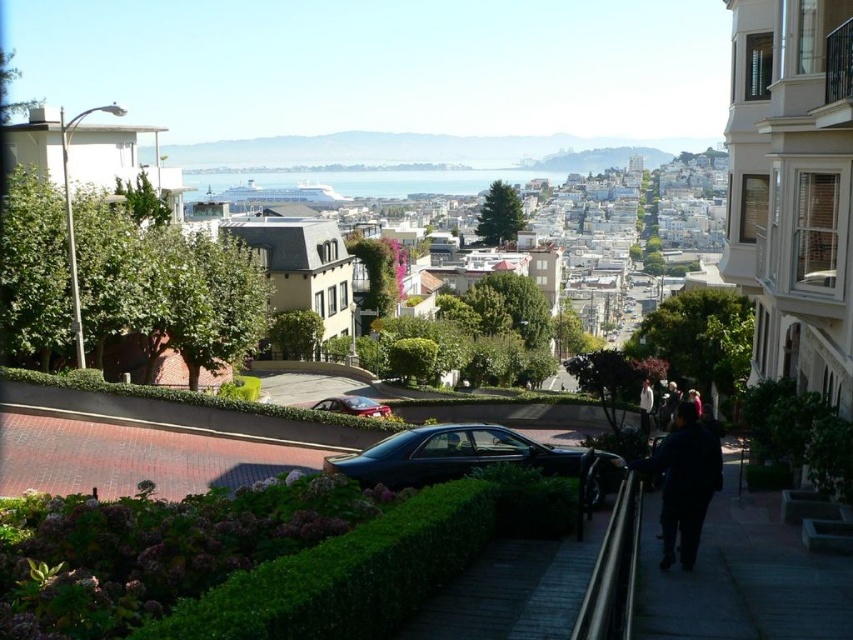
Who is more distant from viewer, (257, 154) or (490, 465)?

Positioned behind is point (257, 154).

Is point (431, 145) more distant than point (467, 461)?

That is True.

Locate an element on the screen. This screenshot has width=853, height=640. green grassy hillside at upper center is located at coordinates (416, 152).

This screenshot has height=640, width=853. In order to click on brick pavement at lower left in this screenshot , I will do `click(132, 456)`.

Can you confirm if dark blue jacket at lower right is taller than white glossy water at center?

In fact, dark blue jacket at lower right may be shorter than white glossy water at center.

In the scene shown: Is dark blue jacket at lower right bigger than white glossy water at center?

Incorrect, dark blue jacket at lower right is not larger than white glossy water at center.

Does point (651, 467) come behind point (430, 173)?

No, it is in front of (430, 173).

What are the coordinates of `dark blue jacket at lower right` in the screenshot? It's located at (683, 481).